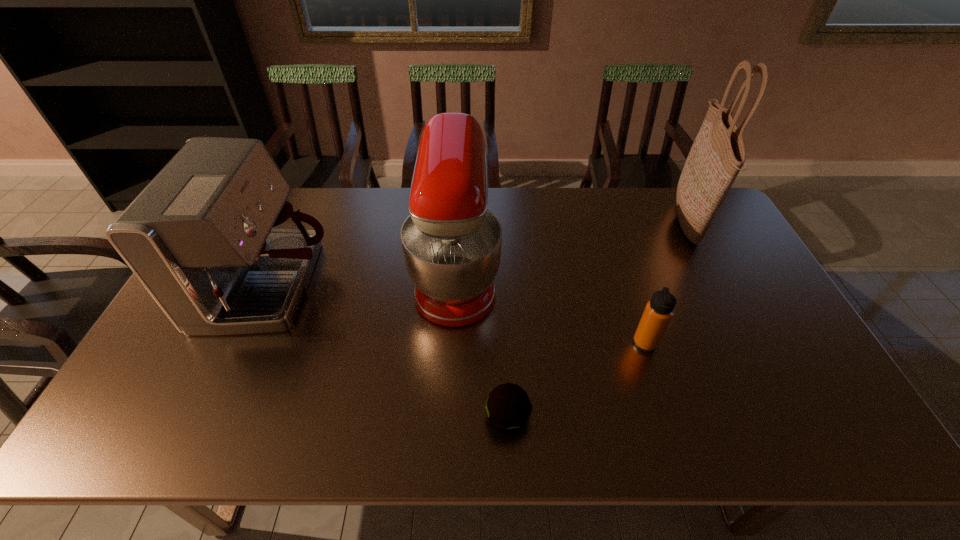
Point out which object is positioned as the second nearest to the rightmost object. Please provide its 2D coordinates. Your answer should be formatted as a tuple, i.e. [(x, y)], where the tuple contains the x and y coordinates of a point satisfying the conditions above.

[(451, 243)]

Identify which object is the fourth closest to the thermos bottle. Please provide its 2D coordinates. Your answer should be formatted as a tuple, i.e. [(x, y)], where the tuple contains the x and y coordinates of a point satisfying the conditions above.

[(212, 238)]

Locate an element on the screen. vacant region that satisfies the following two spatial constraints: 1. on the front-facing side of the mixer; 2. on the right side of the patty is located at coordinates (448, 416).

This screenshot has width=960, height=540. I want to click on vacant area that satisfies the following two spatial constraints: 1. on the back side of the nearest object; 2. on the right side of the second shortest object, so click(x=504, y=343).

Find the location of a particular element. free space that satisfies the following two spatial constraints: 1. on the front-facing side of the mixer; 2. on the left side of the patty is located at coordinates (448, 416).

The height and width of the screenshot is (540, 960). What are the coordinates of `vacant space that satisfies the following two spatial constraints: 1. on the back side of the fourth tallest object; 2. on the front-facing side of the mixer` in the screenshot? It's located at (623, 274).

Where is `blank space that satisfies the following two spatial constraints: 1. on the front side of the rightmost object; 2. on the front of the leftmost object near the spout`? blank space that satisfies the following two spatial constraints: 1. on the front side of the rightmost object; 2. on the front of the leftmost object near the spout is located at coordinates (720, 286).

Locate an element on the screen. The width and height of the screenshot is (960, 540). vacant region that satisfies the following two spatial constraints: 1. on the front-facing side of the mixer; 2. on the back side of the fourth object from left to right is located at coordinates (452, 343).

Where is `free spot that satisfies the following two spatial constraints: 1. on the back side of the fourth object from left to right; 2. on the front of the leftmost object near the spout`? free spot that satisfies the following two spatial constraints: 1. on the back side of the fourth object from left to right; 2. on the front of the leftmost object near the spout is located at coordinates coord(627,286).